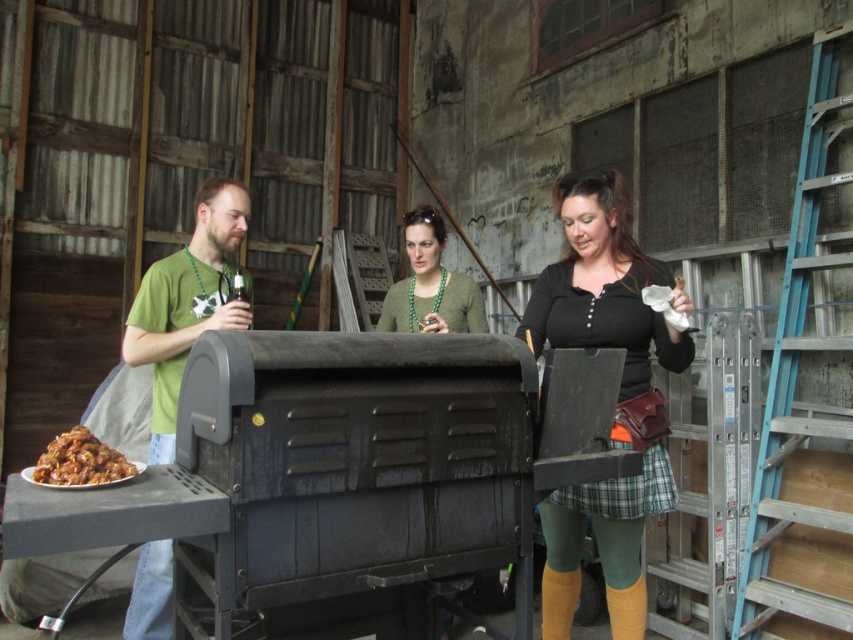
Between green matte shirt at left and green beaded necklace at center, which one has more height?

green matte shirt at left is taller.

Does point (224, 240) come closer to viewer compared to point (407, 257)?

Yes, it is.

What do you see at coordinates (189, 301) in the screenshot?
I see `green matte shirt at left` at bounding box center [189, 301].

Locate an element on the screen. The image size is (853, 640). green matte shirt at left is located at coordinates (189, 301).

Is matte black laptop at center to the right of green plaid skirt at center from the viewer's perspective?

In fact, matte black laptop at center is to the left of green plaid skirt at center.

Is point (601, 237) positioned before point (572, 499)?

No, (601, 237) is further to viewer.

The height and width of the screenshot is (640, 853). Find the location of `matte black laptop at center`. matte black laptop at center is located at coordinates (618, 396).

Is matte green sweater at center in front of green beaded necklace at center?

No, matte green sweater at center is further to the viewer.

Between point (456, 284) and point (398, 284), which one is positioned in front?

Positioned in front is point (456, 284).

Where is `matte green sweater at center`? The image size is (853, 640). matte green sweater at center is located at coordinates point(430,284).